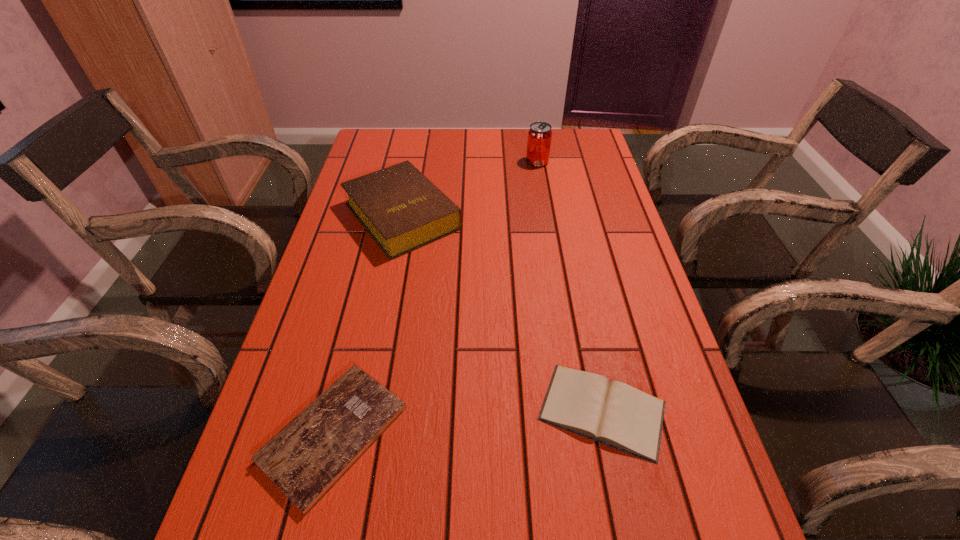
Identify the location of the closest object to the pop soda. (401, 209).

Identify the location of Bible that stands as the closest to the pop soda. The height and width of the screenshot is (540, 960). tap(401, 209).

Locate an element on the screen. The height and width of the screenshot is (540, 960). Bible that is the third closest to the tallest object is located at coordinates (305, 459).

Locate an element on the screen. This screenshot has height=540, width=960. vacant area that satisfies the following two spatial constraints: 1. on the front side of the farthest object; 2. on the right side of the rightmost Bible is located at coordinates (579, 410).

The width and height of the screenshot is (960, 540). Identify the location of free space in the image that satisfies the following two spatial constraints: 1. on the back side of the tallest Bible; 2. on the right side of the pop soda. (413, 162).

The image size is (960, 540). What are the coordinates of `vacant space that satisfies the following two spatial constraints: 1. on the back side of the farthest object; 2. on the right side of the farthest Bible` in the screenshot? It's located at (413, 162).